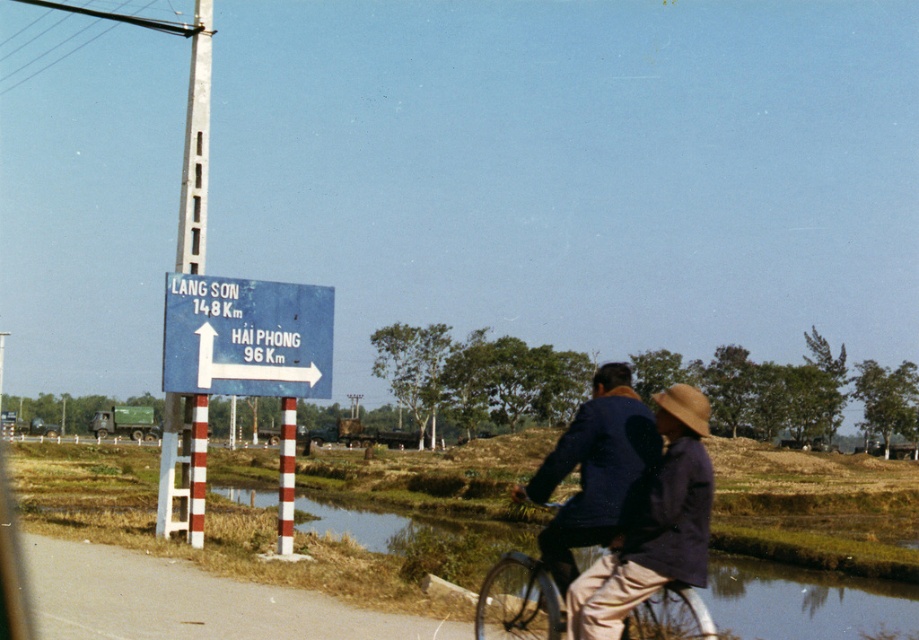
Between dark blue fabric jacket at center and white striped pole at center, which one is positioned higher?

dark blue fabric jacket at center is above.

Looking at this image, is dark blue fabric jacket at center further to camera compared to white striped pole at center?

No, it is not.

Describe the element at coordinates (654, 525) in the screenshot. I see `dark blue fabric jacket at center` at that location.

In order to click on dark blue fabric jacket at center in this screenshot , I will do `click(654, 525)`.

Does dark blue fabric jacket at center come behind metallic silver bicycle at center?

No, it is not.

Who is higher up, dark blue fabric jacket at center or metallic silver bicycle at center?

dark blue fabric jacket at center is higher up.

Which is behind, point (633, 560) or point (657, 593)?

Positioned behind is point (657, 593).

Where is `dark blue fabric jacket at center`? The width and height of the screenshot is (919, 640). dark blue fabric jacket at center is located at coordinates (654, 525).

Measure the distance between point (216, 348) and camera.

Point (216, 348) and camera are 13.15 meters apart.

What do you see at coordinates (246, 337) in the screenshot? I see `blue painted metal sign at upper left` at bounding box center [246, 337].

Find the location of a particular element. The height and width of the screenshot is (640, 919). blue painted metal sign at upper left is located at coordinates (246, 337).